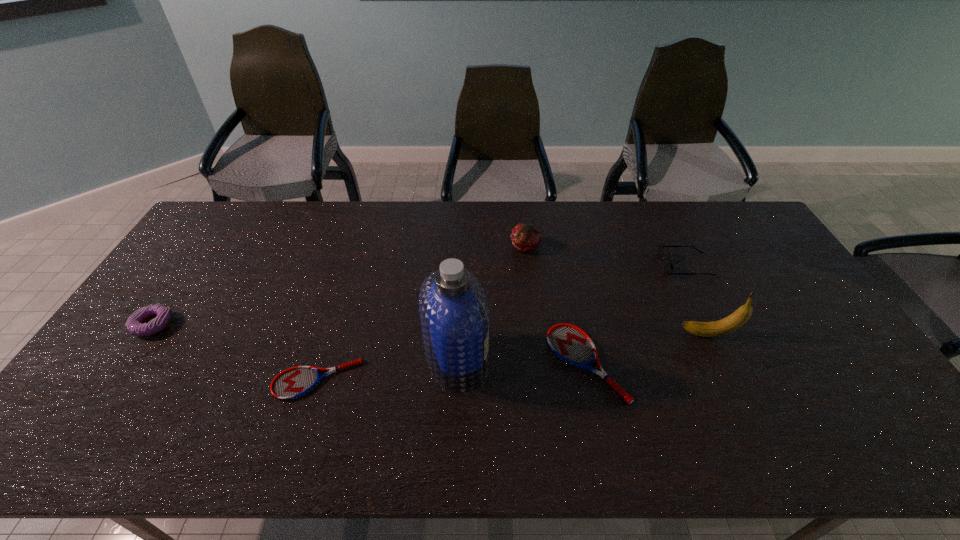
Locate an element on the screen. The width and height of the screenshot is (960, 540). free location located 0.200m on the back of the leftmost object is located at coordinates (195, 265).

The height and width of the screenshot is (540, 960). Find the location of `free space located 0.200m on the back of the third object from left to right`. free space located 0.200m on the back of the third object from left to right is located at coordinates (461, 279).

I want to click on object at the far edge, so click(525, 237).

The image size is (960, 540). Find the location of `cleansing agent present at the near edge`. cleansing agent present at the near edge is located at coordinates (454, 310).

This screenshot has height=540, width=960. Identify the location of object situated at the left edge. click(x=135, y=324).

In the image, there is a desktop. In order to click on vacant space at the far edge in this screenshot , I will do (358, 237).

The image size is (960, 540). I want to click on vacant space at the near edge of the desktop, so click(660, 390).

Image resolution: width=960 pixels, height=540 pixels. I want to click on vacant area at the left edge of the desktop, so click(127, 369).

In the image, there is a desktop. Identify the location of vacant space at the right edge. This screenshot has width=960, height=540. (775, 273).

Where is `vacant space at the far right corner of the desktop`? vacant space at the far right corner of the desktop is located at coordinates (747, 213).